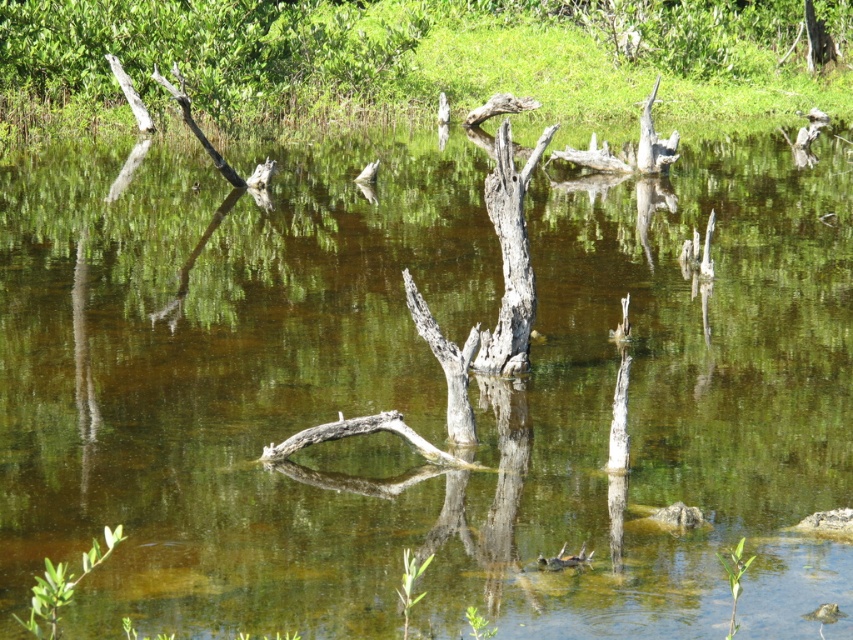
You are a wildlife photographer with a camera bag that requires a 2 meter space to set up. You want to position your equipment between the dead wood at upper center and the smooth brown tree trunk at upper left. Can you set up your equipment there?

The distance between the dead wood at upper center and the smooth brown tree trunk at upper left is 1.84 meters. Since your camera setup requires 2 meters of space, you won not have enough room to set up your equipment between them.

You are standing in the wetland scene and want to place a small buoy at one of the two points, point [146,22] or point [531,308]. Which point is closer to you where you can easily reach and secure the buoy?

Point [146,22] is further to the camera than point [531,308]. Therefore, point [531,308] is closer to you, making it easier to reach and secure the buoy.

You are a nature photographer standing at the center of the wetland. You want to capture a closeup shot of the smooth brown tree trunk at upper left. Based on its coordinates, in which direction should you move to get closer to it?

The smooth brown tree trunk at upper left is located at point (207, 51), so you should move towards the upper left direction to get closer to it.